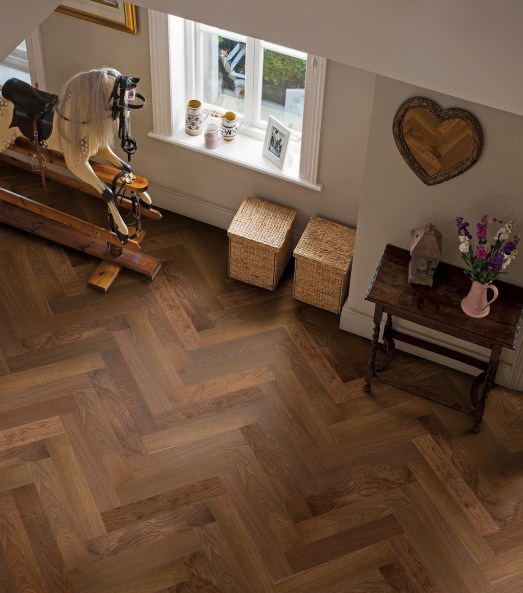
Locate an element on the screen. Image resolution: width=523 pixels, height=593 pixels. table is located at coordinates (443, 317).